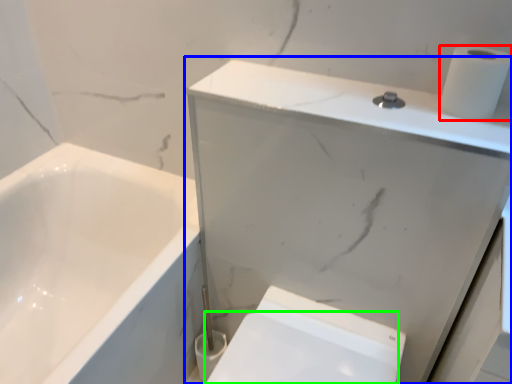
Question: Considering the real-world distances, which object is farthest from toilet paper (highlighted by a red box)? medicine cabinet (highlighted by a blue box) or bidet (highlighted by a green box)?

Choices:
 (A) medicine cabinet
 (B) bidet

Answer: (B)